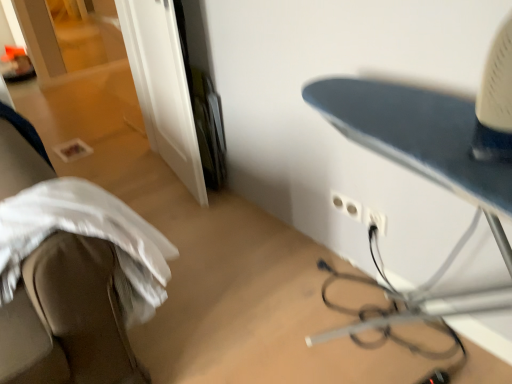
Question: Considering their positions, is white plastic electric outlet at lower right, the second electric outlet viewed from the right, located in front of or behind white plastic electric outlet at center-right, the 1th electric outlet positioned from the right?

Choices:
 (A) front
 (B) behind

Answer: (B)

Question: Is point (330, 192) closer or farther from the camera than point (367, 213)?

Choices:
 (A) closer
 (B) farther

Answer: (B)

Question: Which of these objects is positioned farthest from the white plastic electric outlet at lower right, the 1th electric outlet viewed from the left?

Choices:
 (A) white plastic electric outlet at center-right, the 1th electric outlet positioned from the right
 (B) white fabric at left
 (C) blue metallic ironing board at right

Answer: (B)

Question: Estimate the real-world distances between objects in this image. Which object is closer to the blue metallic ironing board at right?

Choices:
 (A) white plastic electric outlet at lower right, the second electric outlet viewed from the right
 (B) white fabric at left
 (C) white plastic electric outlet at center-right, which ranks as the 2th electric outlet in left-to-right order

Answer: (C)